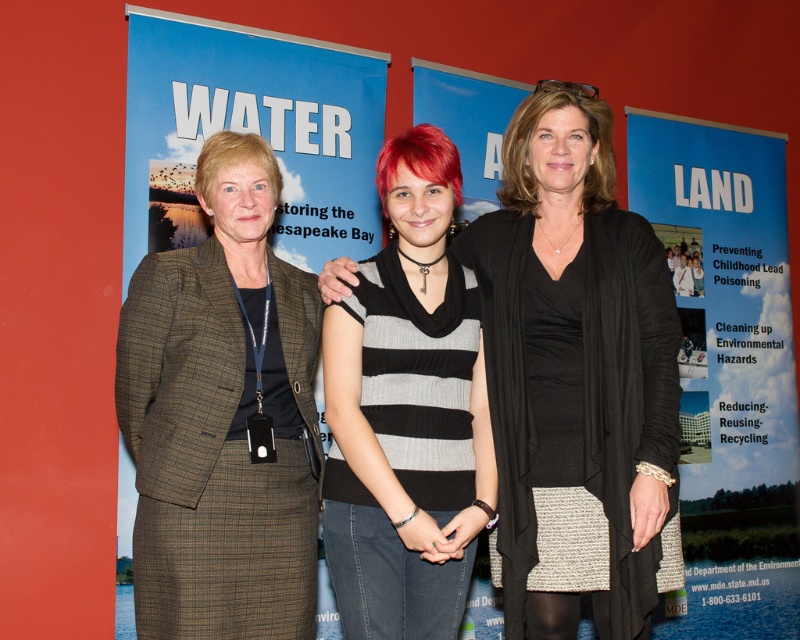
Does plaid wool suit at center have a lesser height compared to blue fabric poster at right?

Yes, plaid wool suit at center is shorter than blue fabric poster at right.

Does plaid wool suit at center appear under blue fabric poster at right?

Actually, plaid wool suit at center is above blue fabric poster at right.

Is point (300, 500) behind point (728, 388)?

No, (300, 500) is closer to viewer.

Locate an element on the screen. This screenshot has width=800, height=640. plaid wool suit at center is located at coordinates (222, 417).

Does black knit sweater at center appear on the right side of blue fabric poster at right?

In fact, black knit sweater at center is to the left of blue fabric poster at right.

Is black knit sweater at center wider than blue fabric poster at right?

In fact, black knit sweater at center might be narrower than blue fabric poster at right.

Which is behind, point (490, 294) or point (690, 124)?

Positioned behind is point (690, 124).

Identify the location of black knit sweater at center. (576, 378).

Does plaid wool suit at center lie in front of striped sweater at center?

Yes, plaid wool suit at center is in front of striped sweater at center.

Does point (222, 365) come in front of point (354, 561)?

No.

Who is more distant from viewer, (226,209) or (394,141)?

The point (226,209) is more distant.

Where is `plaid wool suit at center`? plaid wool suit at center is located at coordinates (222, 417).